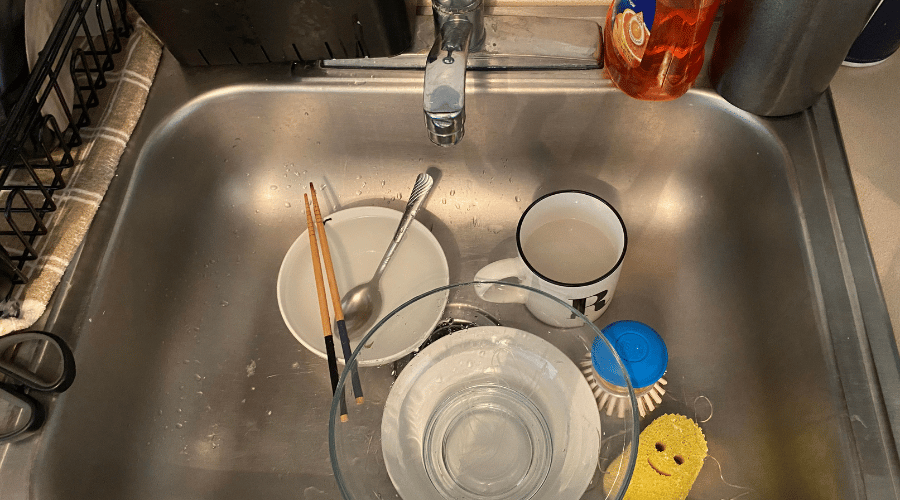
You are a GUI agent. You are given a task and a screenshot of the screen. Output one action in this format:
    pyautogui.click(x=<x>, y=<y>)
    Task: Click on the bowl
    The image size is (900, 500).
    Given the screenshot: What is the action you would take?
    (x=438, y=248)